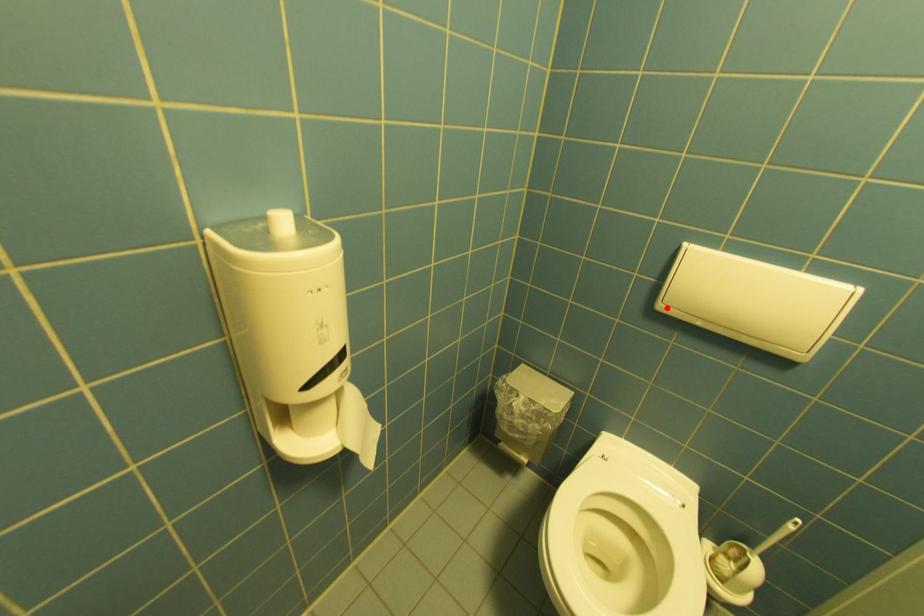
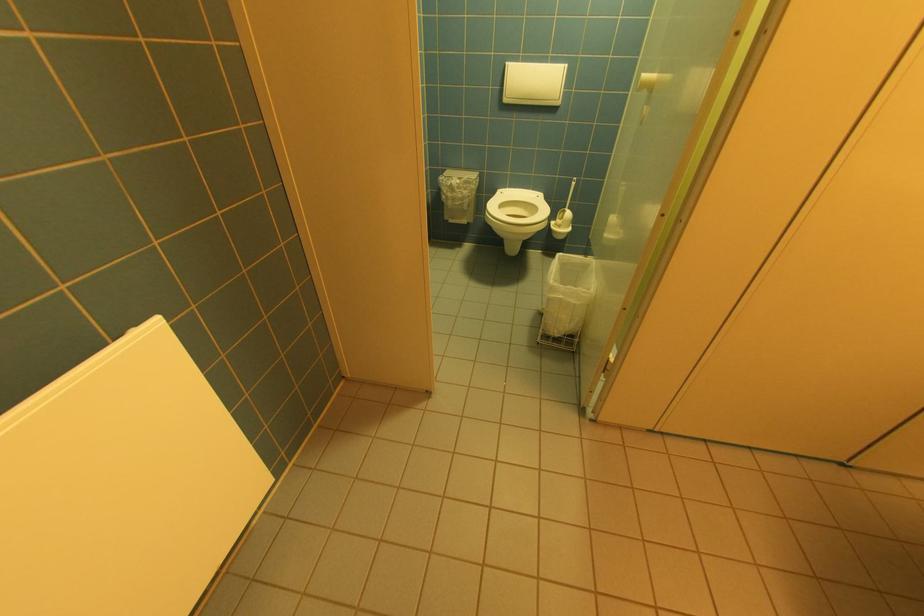
Find the pixel in the second image that matches the highlighted location in the first image.

(512, 100)